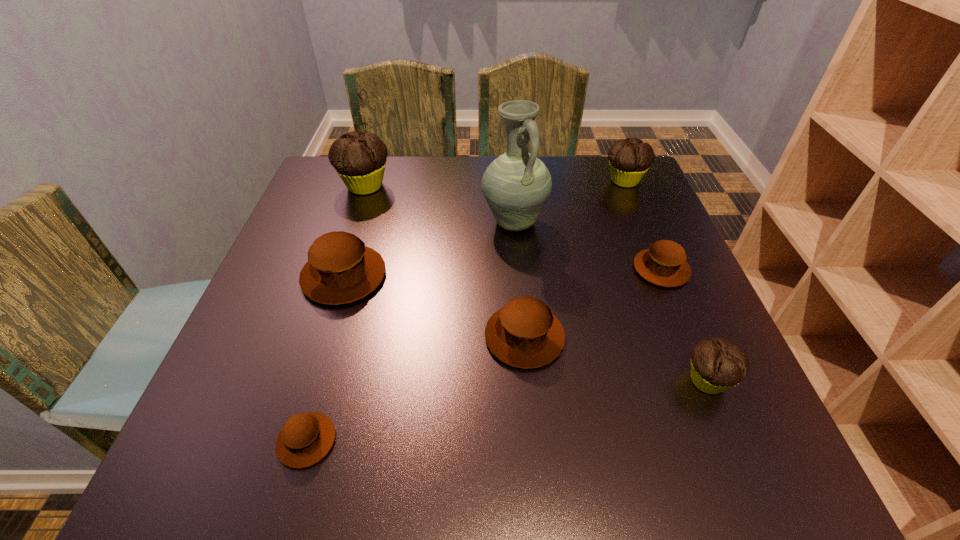
Locate an element on the screen. The image size is (960, 540). the nearest muffin is located at coordinates (306, 438).

Where is `the nearest object`? The image size is (960, 540). the nearest object is located at coordinates (306, 438).

Locate an element on the screen. vacant point located on the handle side of the tallest object is located at coordinates (518, 277).

You are a GUI agent. You are given a task and a screenshot of the screen. Output one action in this format:
    pyautogui.click(x=<x>, y=<y>)
    Task: Click on the vacant space situated on the left of the biggest chocolate muffin
    
    Given the screenshot: What is the action you would take?
    pyautogui.click(x=316, y=186)

The height and width of the screenshot is (540, 960). Find the location of `blank area located on the front of the second smallest chocolate muffin`. blank area located on the front of the second smallest chocolate muffin is located at coordinates (667, 282).

Identify the location of vacant region located on the front of the biggest brown muffin. (322, 349).

Find the location of `vacant region located on the left of the second biggest brown muffin`. vacant region located on the left of the second biggest brown muffin is located at coordinates (351, 337).

The image size is (960, 540). I want to click on vacant space positioned on the back of the nearest chocolate muffin, so click(647, 237).

Locate an element on the screen. free spot located on the left of the third biggest brown muffin is located at coordinates (505, 269).

Image resolution: width=960 pixels, height=540 pixels. Find the location of `free space located 0.250m on the right of the shortest object`. free space located 0.250m on the right of the shortest object is located at coordinates (496, 441).